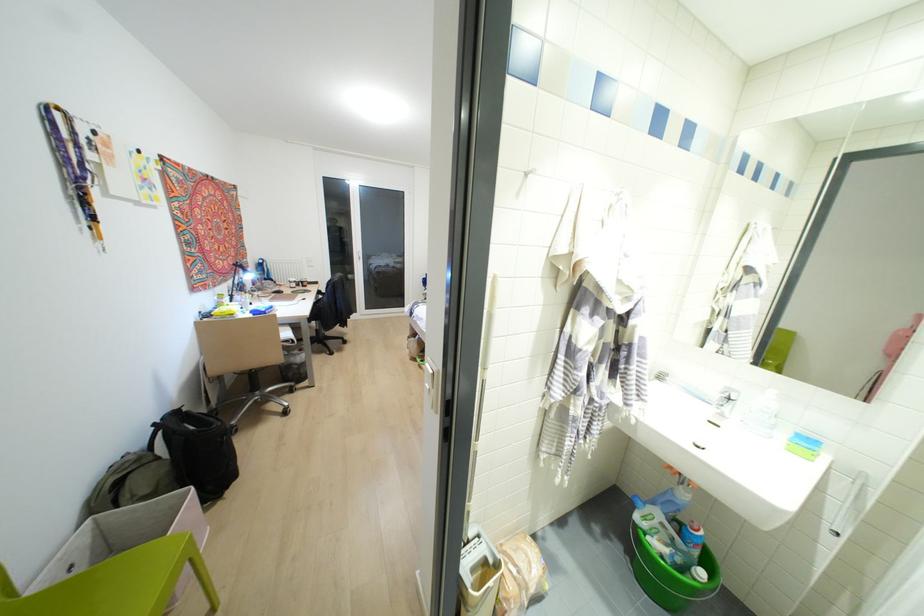
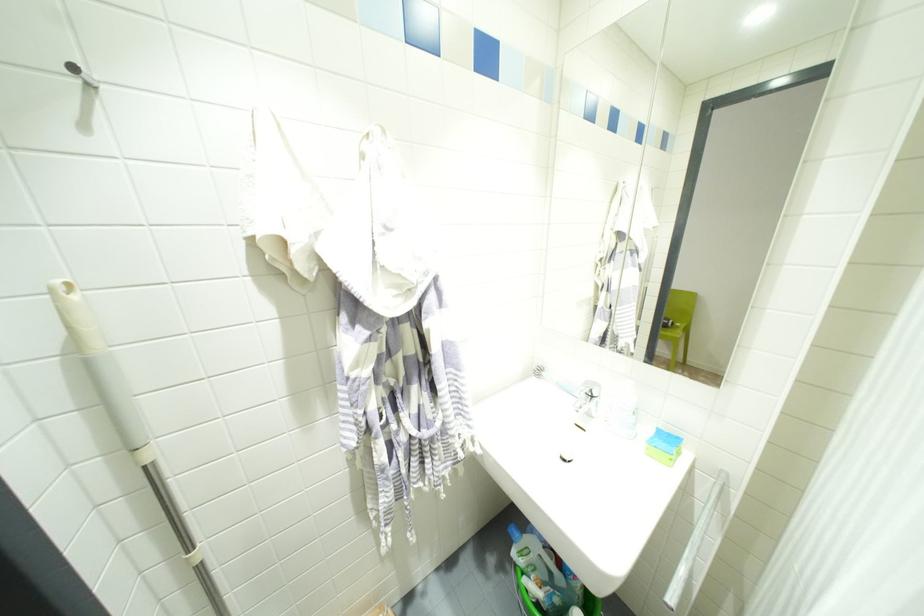
Locate, in the second image, the point that corresponds to point 526,174 in the first image.

(91, 84)